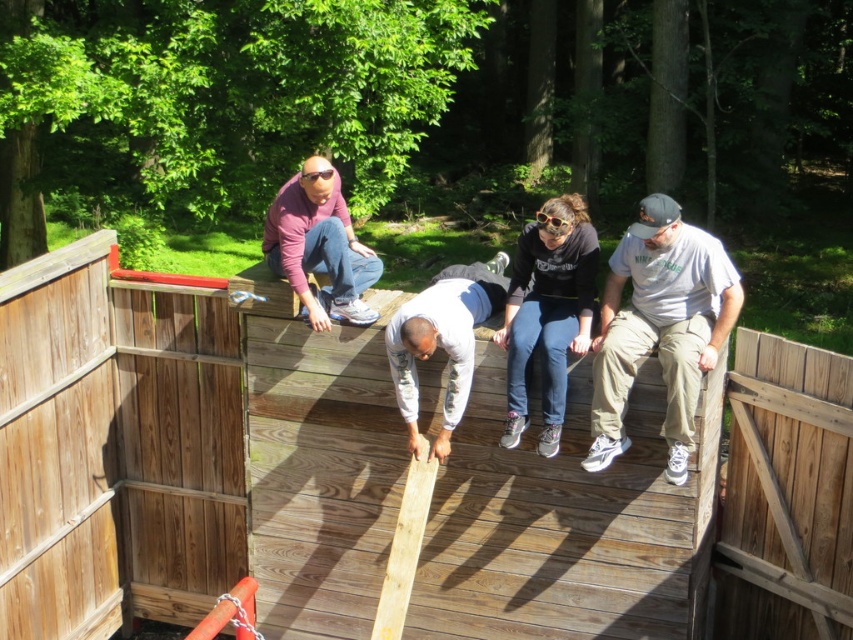
From the picture: Is wooden deck at center smaller than matte purple shirt at upper center?

No.

Where is `wooden deck at center`? Image resolution: width=853 pixels, height=640 pixels. wooden deck at center is located at coordinates (566, 522).

Where is `wooden deck at center`? wooden deck at center is located at coordinates (566, 522).

Is wooden deck at center smaller than gray sweatpants at center?

No.

Is point (643, 547) more distant than point (442, 445)?

That is True.

Locate an element on the screen. Image resolution: width=853 pixels, height=640 pixels. wooden deck at center is located at coordinates (566, 522).

Does wooden deck at center lie in front of matte black hoodie at center?

That is True.

Does wooden deck at center appear on the right side of matte black hoodie at center?

In fact, wooden deck at center is to the left of matte black hoodie at center.

Find the location of a particular element. This screenshot has height=640, width=853. wooden deck at center is located at coordinates (566, 522).

Identify the location of wooden deck at center. (566, 522).